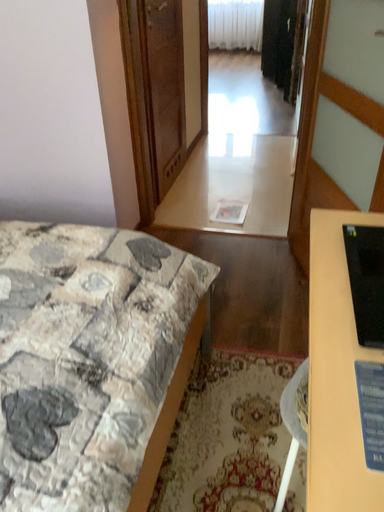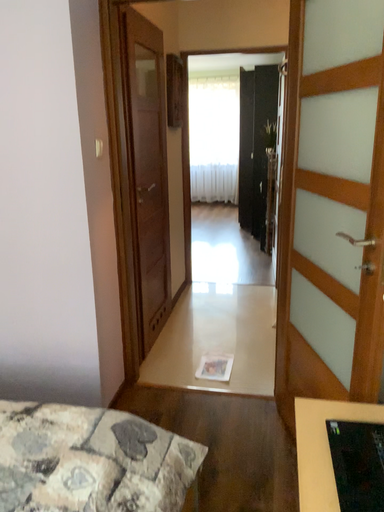
Question: Which way did the camera rotate in the video?

Choices:
 (A) rotated upward
 (B) rotated downward

Answer: (A)